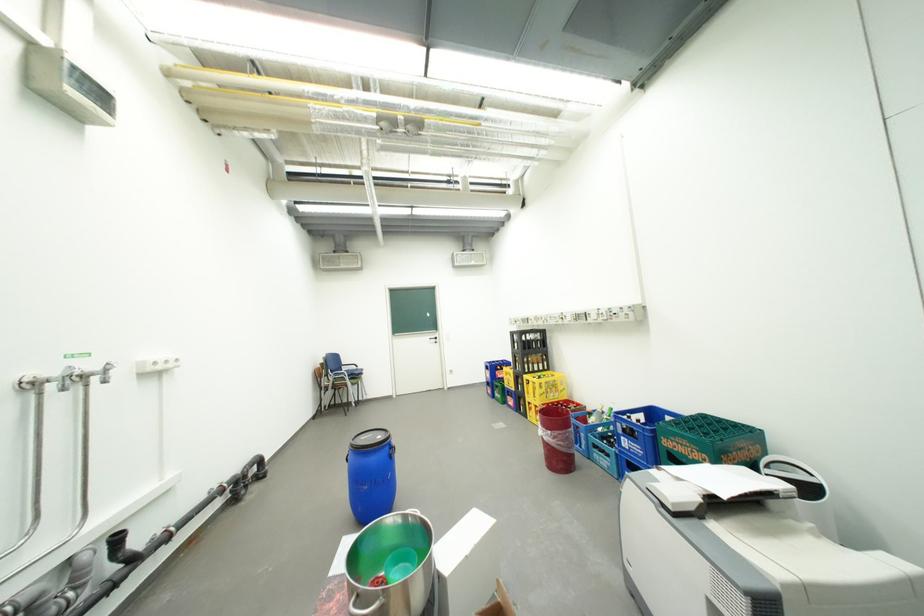
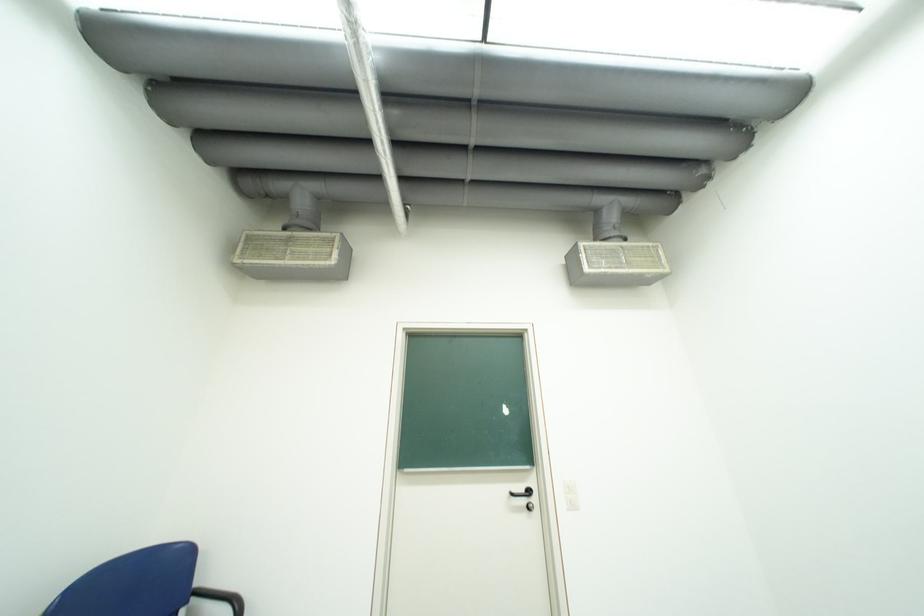
Where in the second image is the point corresponding to point (441, 339) from the first image?

(523, 495)